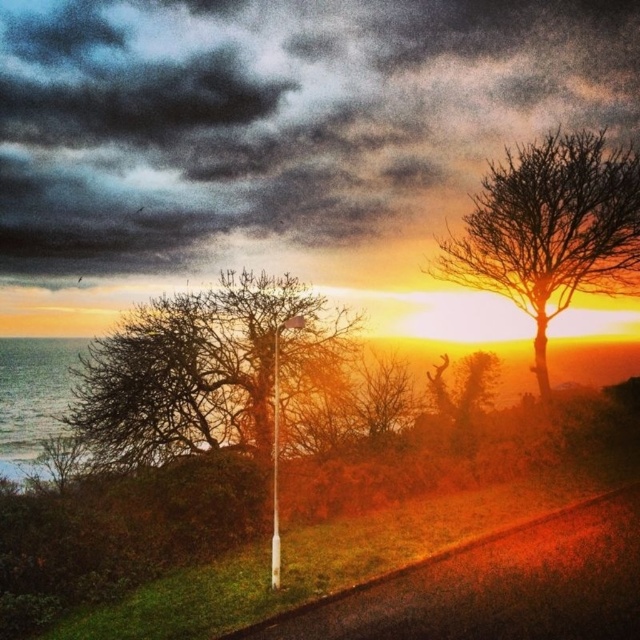
Is bare branches at left wider than bare branches at upper right?

No, bare branches at left is not wider than bare branches at upper right.

Can you confirm if bare branches at left is positioned below bare branches at upper right?

Yes.

Which is in front, point (314, 371) or point (484, 179)?

Point (314, 371)

I want to click on bare branches at left, so click(202, 369).